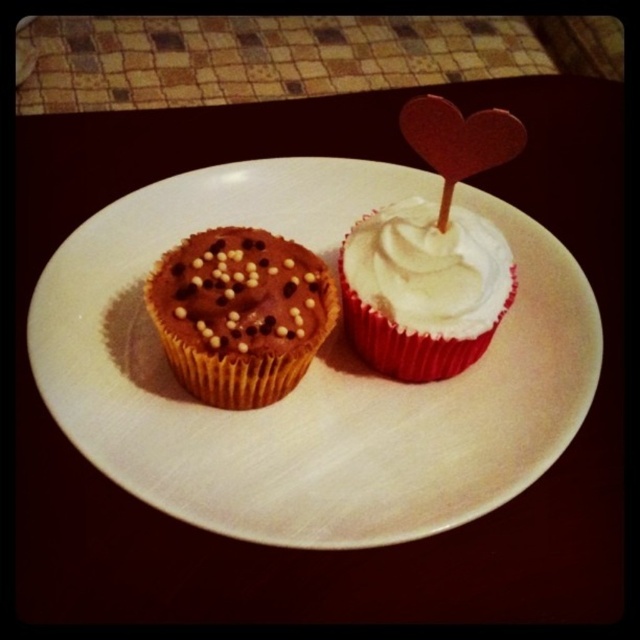
You are arranging cupcakes on a matte paper plate at center and a white matte cupcake at center. According to the scene, which object is positioned to the left?

The matte paper plate at center is to the left of the white matte cupcake at center, so the matte paper plate at center is positioned to the left.

You are a chef trying to place a new cupcake onto the matte paper plate at center. The new cupcake has a diameter of 3 inches. Can you fit it on the plate without overlapping the white matte cupcake at center?

The matte paper plate at center and white matte cupcake at center are 6.31 inches apart. Since the new cupcake has a diameter of 3 inches, there is enough space between them to place it without overlapping. The minimum distance required would be at least 3 inches, so 6.31 inches is sufficient.